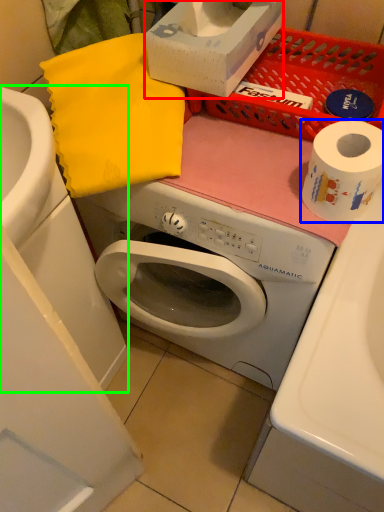
Question: Which object is positioned closest to box (highlighted by a red box)? Select from toilet paper (highlighted by a blue box) and sink (highlighted by a green box).

Choices:
 (A) toilet paper
 (B) sink

Answer: (A)